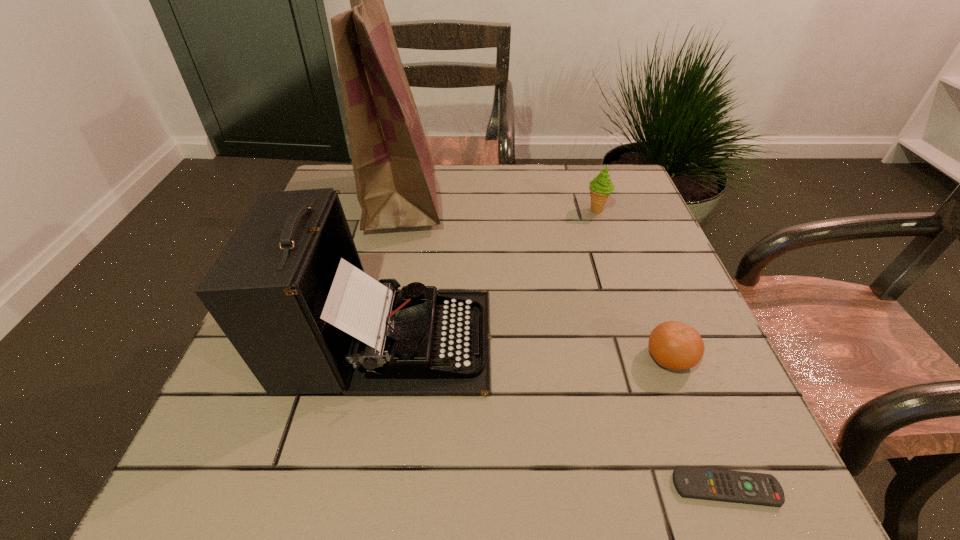
The height and width of the screenshot is (540, 960). I want to click on object positioned at the far right corner, so click(x=601, y=187).

At what (x,y) coordinates should I click in order to perform the action: click on object that is at the near right corner. Please return your answer as a coordinate pair (x, y). The image size is (960, 540). Looking at the image, I should click on (690, 482).

This screenshot has height=540, width=960. What are the coordinates of `free location at the far edge of the desktop` in the screenshot? It's located at (492, 181).

What are the coordinates of `vacant region at the near edge of the desktop` in the screenshot? It's located at (318, 502).

What are the coordinates of `free space at the left edge of the desktop` in the screenshot? It's located at 241,378.

At what (x,y) coordinates should I click in order to perform the action: click on free space at the right edge of the desktop. Please return your answer as a coordinate pair (x, y). Looking at the image, I should click on (651, 388).

Find the location of `vacant space that's between the third shortest object and the tallest object`. vacant space that's between the third shortest object and the tallest object is located at coordinates (499, 205).

Locate an element on the screen. The height and width of the screenshot is (540, 960). free space between the second tallest object and the grocery bag is located at coordinates (394, 269).

Image resolution: width=960 pixels, height=540 pixels. What are the coordinates of `blank region between the icecream and the clementine` in the screenshot? It's located at (634, 284).

Find the location of a particular element. Image resolution: width=960 pixels, height=540 pixels. empty location between the clementine and the tallest object is located at coordinates (536, 279).